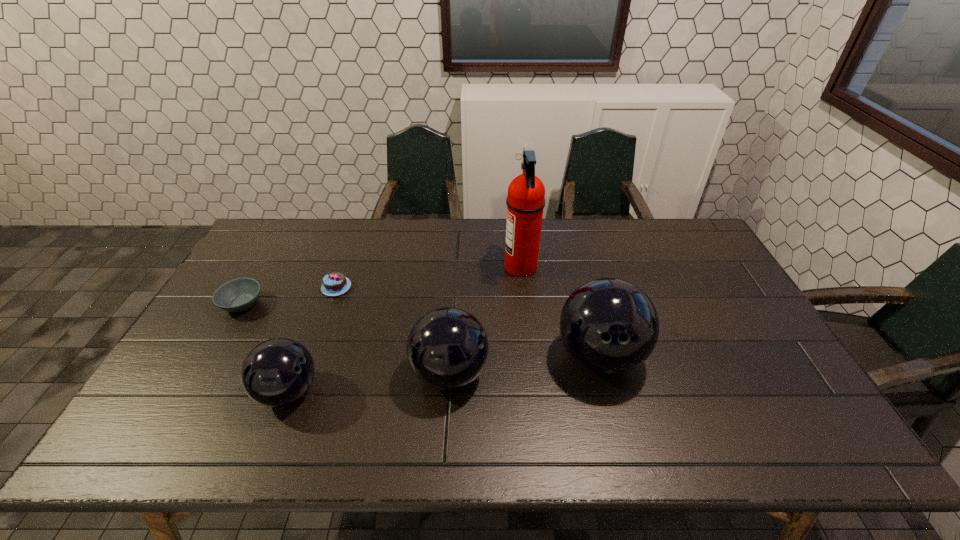
Where is `vacant space located on the side of the leftmost bowling ball with the finger holes`? The height and width of the screenshot is (540, 960). vacant space located on the side of the leftmost bowling ball with the finger holes is located at coordinates (417, 392).

I want to click on free location located on the side of the third tallest object with the finger holes, so click(x=628, y=373).

Where is `vacant space located on the side of the fifth shortest object with the finger holes`? This screenshot has width=960, height=540. vacant space located on the side of the fifth shortest object with the finger holes is located at coordinates (614, 413).

You are a GUI agent. You are given a task and a screenshot of the screen. Output one action in this format:
    pyautogui.click(x=<x>, y=<y>)
    Task: Click on the blank area located 0.280m on the right of the chocolate cake
    
    Given the screenshot: What is the action you would take?
    pyautogui.click(x=441, y=287)

Locate an element on the screen. This screenshot has width=960, height=540. free space located on the side of the fire extinguisher near the handle is located at coordinates (413, 267).

Locate an element on the screen. vacant space located on the side of the fire extinguisher near the handle is located at coordinates (464, 267).

Where is `vacant area located 0.270m on the side of the fire extinguisher near the handle`? This screenshot has width=960, height=540. vacant area located 0.270m on the side of the fire extinguisher near the handle is located at coordinates (421, 267).

You are a GUI agent. You are given a task and a screenshot of the screen. Output one action in this format:
    pyautogui.click(x=<x>, y=<y>)
    Task: Click on the vacant space located 0.130m on the right of the soup bowl
    
    Given the screenshot: What is the action you would take?
    pyautogui.click(x=307, y=304)

Find the location of a particular element. object situated at the far edge is located at coordinates (525, 202).

Find the location of a particular element. Image resolution: width=960 pixels, height=540 pixels. object present at the left edge is located at coordinates (237, 295).